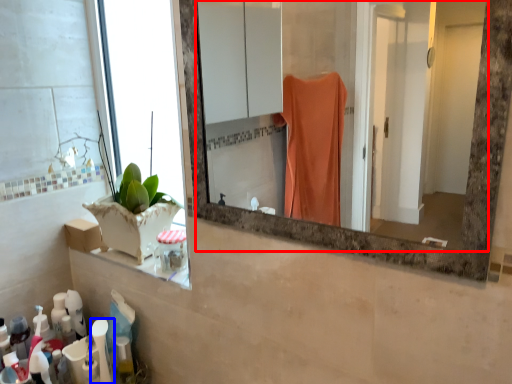
Question: Which object appears farthest to the camera in this image, mirror (highlighted by a red box) or toiletry (highlighted by a blue box)?

Choices:
 (A) mirror
 (B) toiletry

Answer: (B)